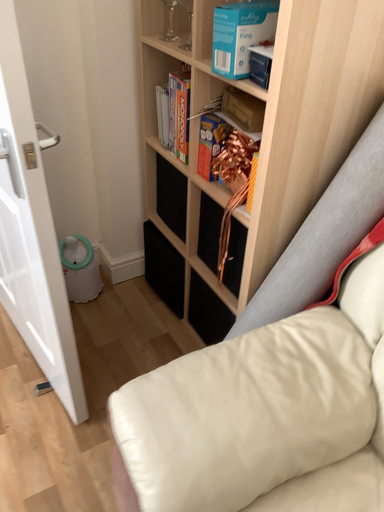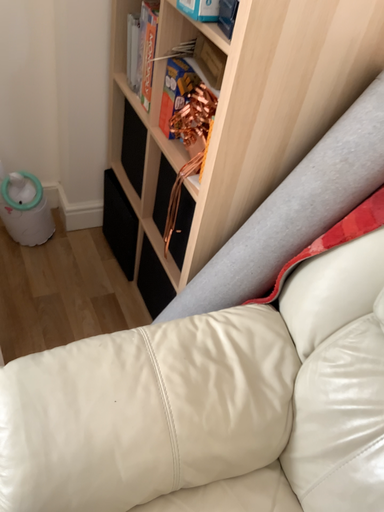
Question: Which way did the camera rotate in the video?

Choices:
 (A) rotated upward
 (B) rotated downward

Answer: (B)